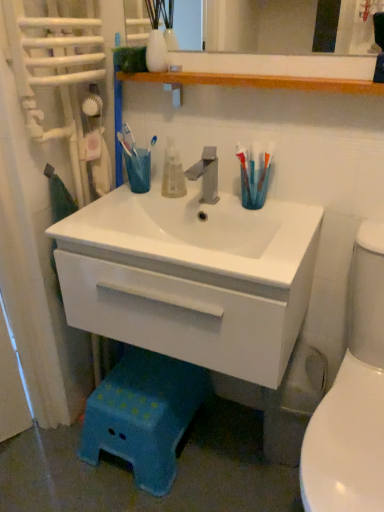
Image resolution: width=384 pixels, height=512 pixels. Identify the location of free space to the right of satin nickel faucet at center. (271, 208).